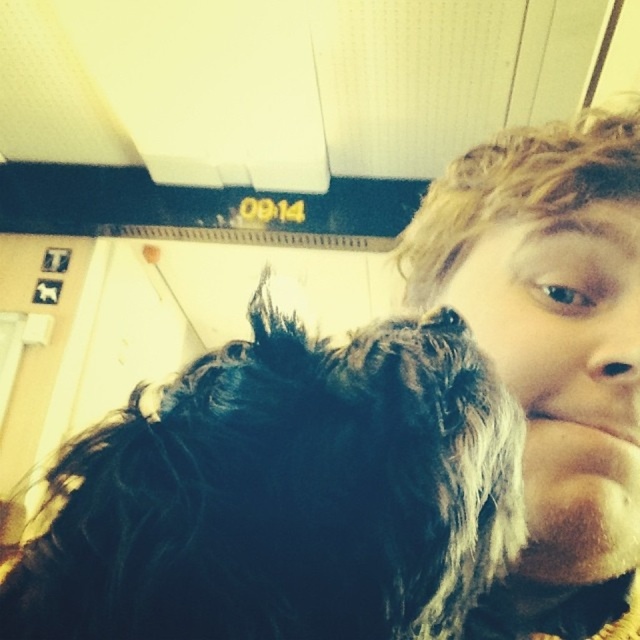
Question: Is black fuzzy dog at center behind brown matte nose at center?

Choices:
 (A) no
 (B) yes

Answer: (A)

Question: Which point is closer to the camera?

Choices:
 (A) brown matte nose at center
 (B) black fuzzy dog at center
 (C) curly blonde hair at right

Answer: (B)

Question: Does black fuzzy dog at center have a lesser width compared to curly blonde hair at right?

Choices:
 (A) yes
 (B) no

Answer: (B)

Question: Is black fuzzy dog at center behind curly blonde hair at right?

Choices:
 (A) yes
 (B) no

Answer: (B)

Question: Which point is closer to the camera taking this photo?

Choices:
 (A) (620, 324)
 (B) (560, 198)

Answer: (A)

Question: Which of the following is the farthest from the observer?

Choices:
 (A) (627, 308)
 (B) (250, 388)

Answer: (A)